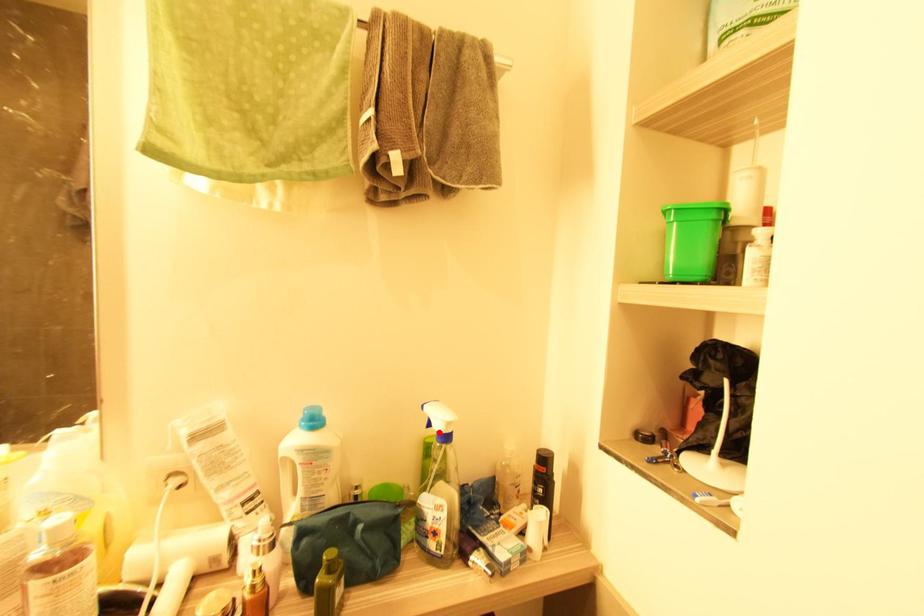
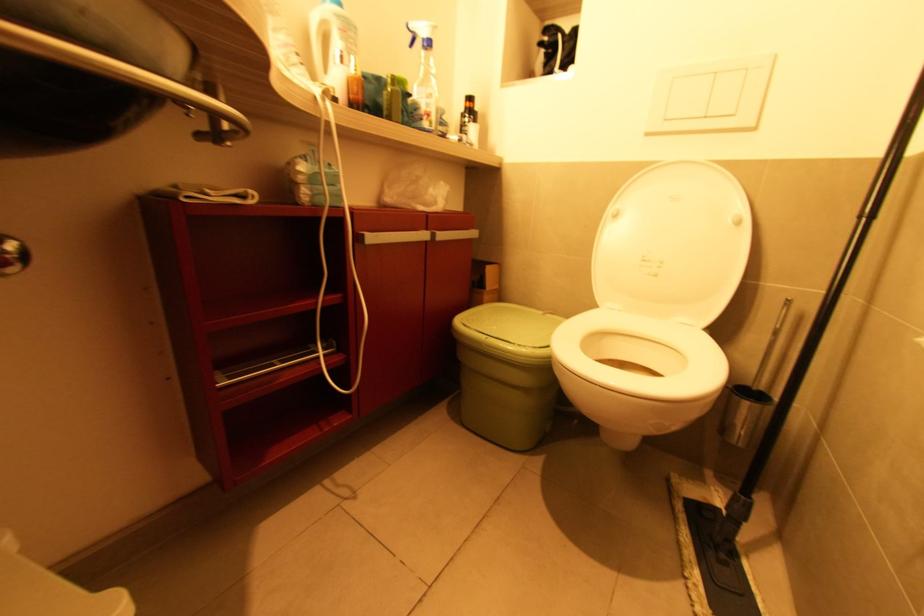
The point at the highlighted location is marked in the first image. Where is the corresponding point in the second image?

(427, 42)